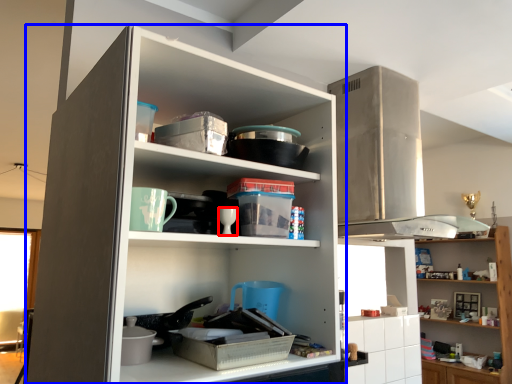
Question: Which object appears farthest to the camera in this image, tableware (highlighted by a red box) or cupboard (highlighted by a blue box)?

Choices:
 (A) tableware
 (B) cupboard

Answer: (A)